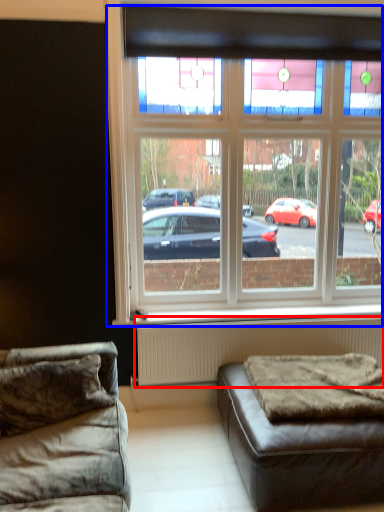
Question: Which object is further to the camera taking this photo, radiator (highlighted by a red box) or window (highlighted by a blue box)?

Choices:
 (A) radiator
 (B) window

Answer: (A)